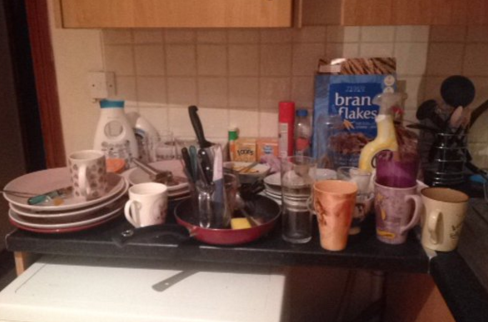
Where is `back splash`? The image size is (488, 322). back splash is located at coordinates 205,71.